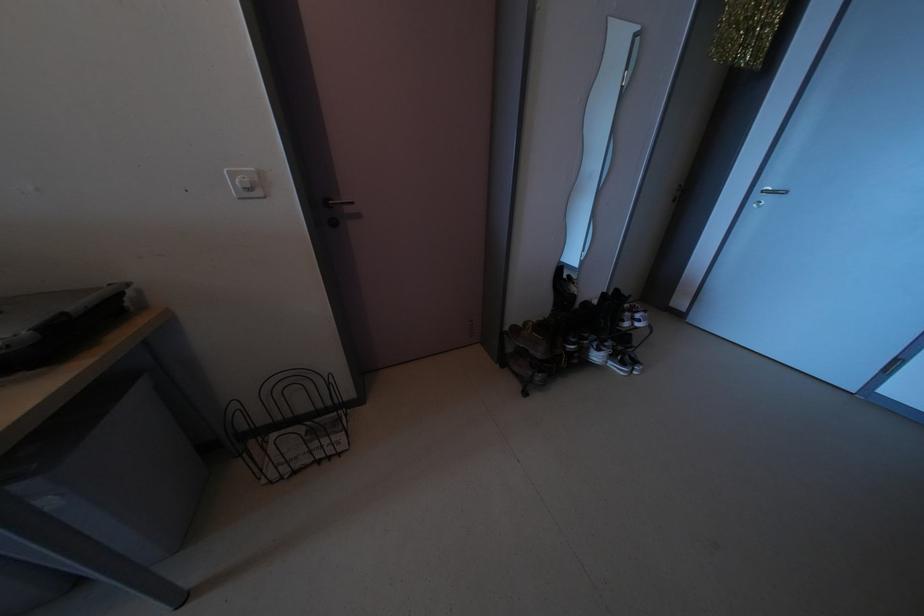
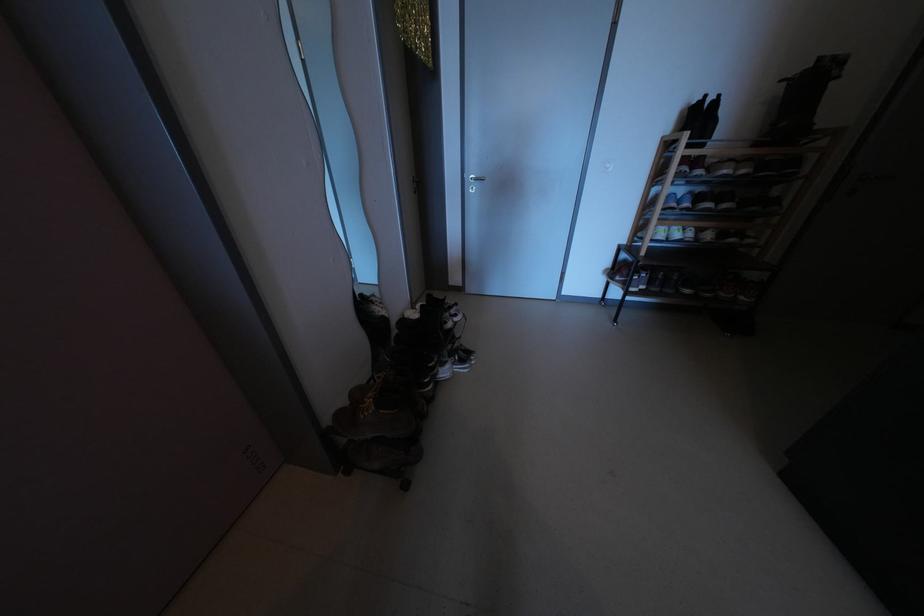
Question: The camera is either moving clockwise (left) or counter-clockwise (right) around the object. The first image is from the beginning of the video and the second image is from the end. Is the camera moving left or right when shooting the video?

Choices:
 (A) Left
 (B) Right

Answer: (A)